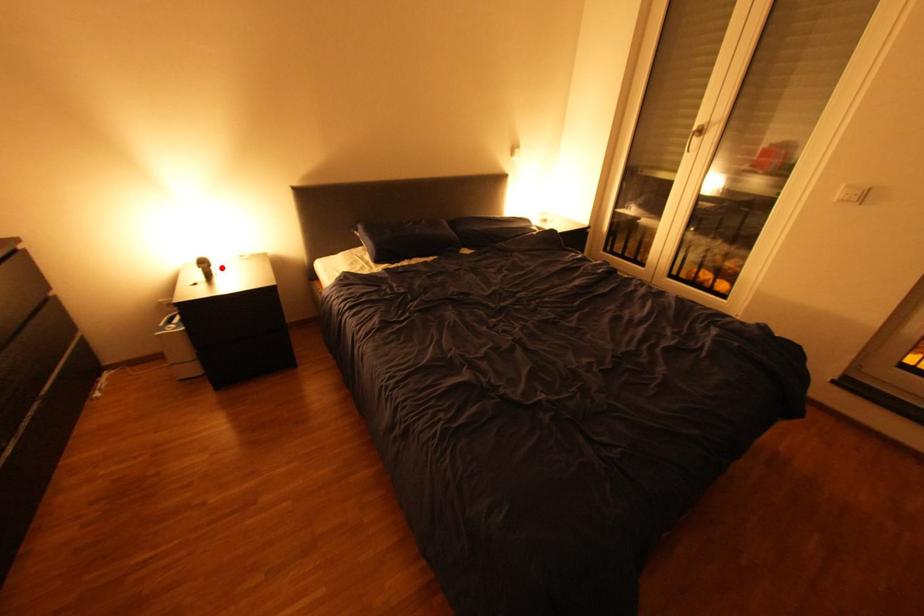
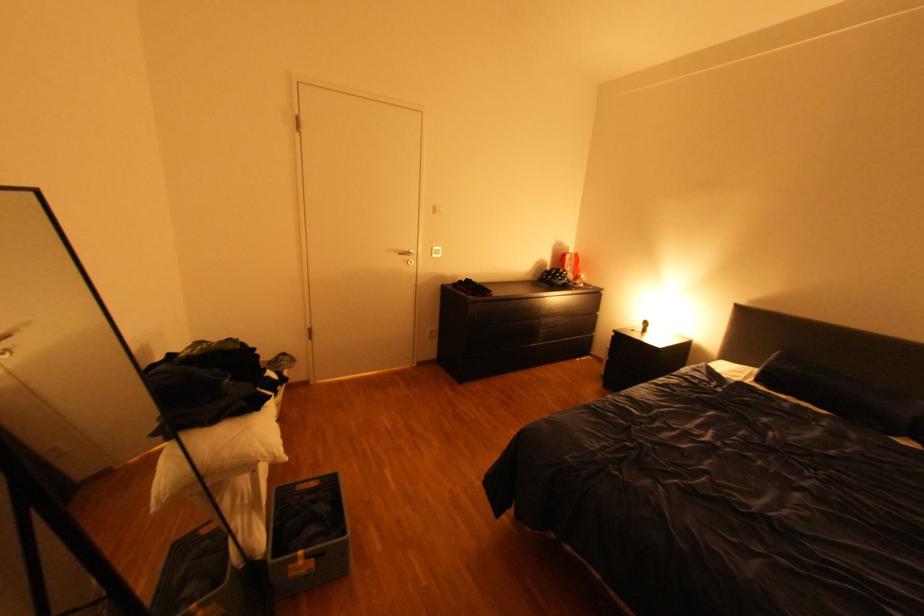
Locate, in the second image, the point that corresponds to the highlighted location in the first image.

(659, 328)